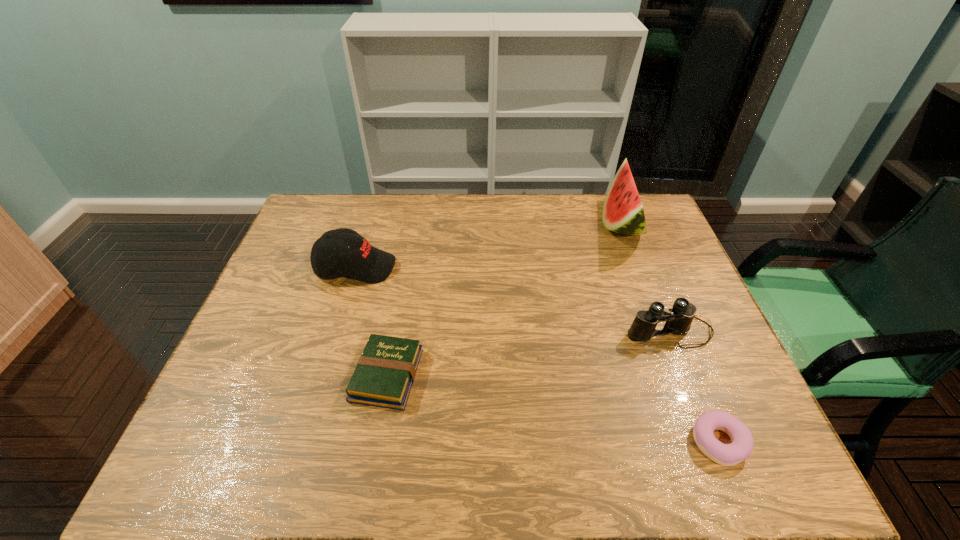
Locate an element on the screen. The image size is (960, 540). vacant space located on the back of the book is located at coordinates (399, 303).

Find the location of `blank space located on the back of the pastry`. blank space located on the back of the pastry is located at coordinates (690, 372).

Image resolution: width=960 pixels, height=540 pixels. Identify the location of object present at the far edge. (623, 212).

Locate an element on the screen. The width and height of the screenshot is (960, 540). object at the near edge is located at coordinates (741, 447).

Find the location of a particular element. This screenshot has height=540, width=960. object that is at the left edge is located at coordinates (351, 255).

This screenshot has width=960, height=540. In order to click on watermelon that is at the right edge in this screenshot , I will do `click(623, 212)`.

Image resolution: width=960 pixels, height=540 pixels. I want to click on binoculars that is at the right edge, so click(679, 320).

This screenshot has height=540, width=960. Identify the location of pastry that is at the right edge. (741, 447).

Locate an element on the screen. object positioned at the far right corner is located at coordinates pos(623,212).

Where is `object at the near right corner`? object at the near right corner is located at coordinates (741, 447).